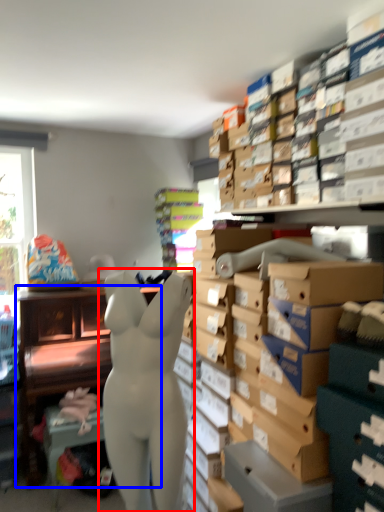
Question: Which object is further to the camera taking this photo, person (highlighted by a red box) or furniture (highlighted by a blue box)?

Choices:
 (A) person
 (B) furniture

Answer: (B)